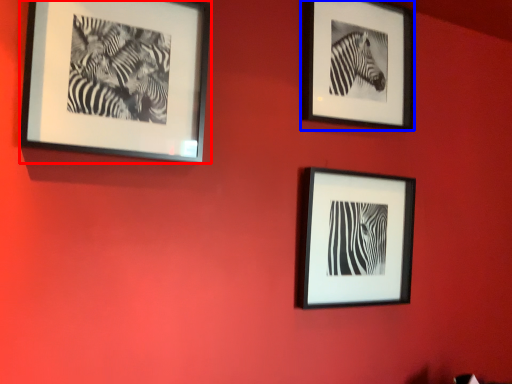
Question: Among these objects, which one is nearest to the camera, picture frame (highlighted by a red box) or picture frame (highlighted by a blue box)?

Choices:
 (A) picture frame
 (B) picture frame

Answer: (A)